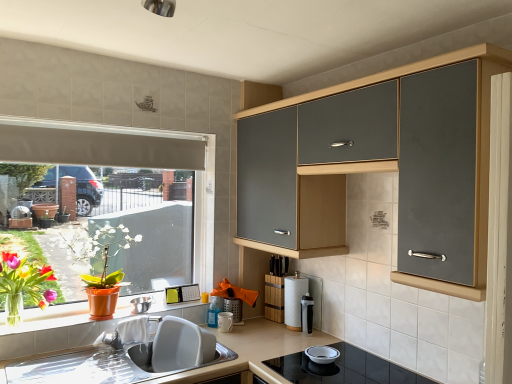
Where is `vacant point to the right of metallic stainless steel bowl at upper left, which is the sixth appliance from right to left`? Image resolution: width=512 pixels, height=384 pixels. vacant point to the right of metallic stainless steel bowl at upper left, which is the sixth appliance from right to left is located at coordinates (167, 313).